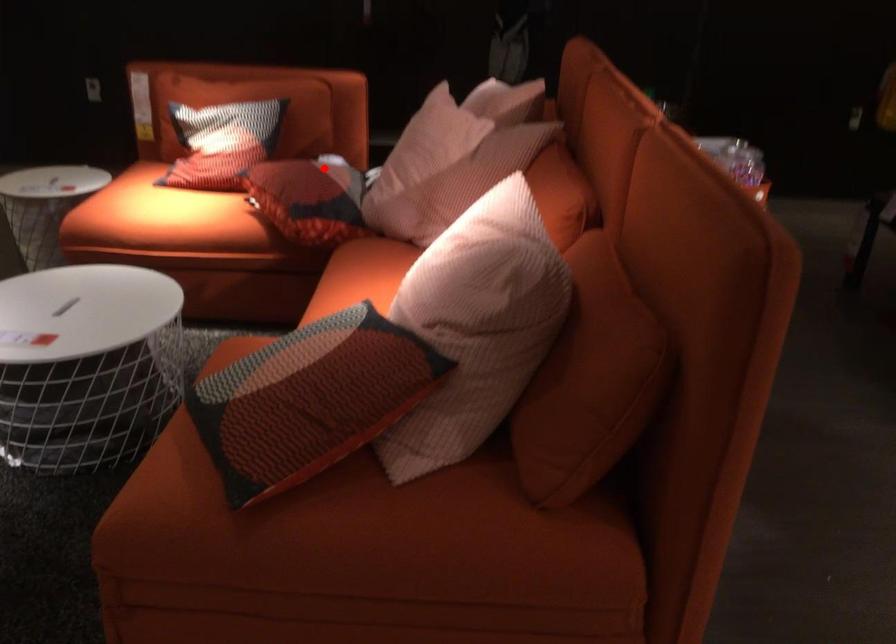
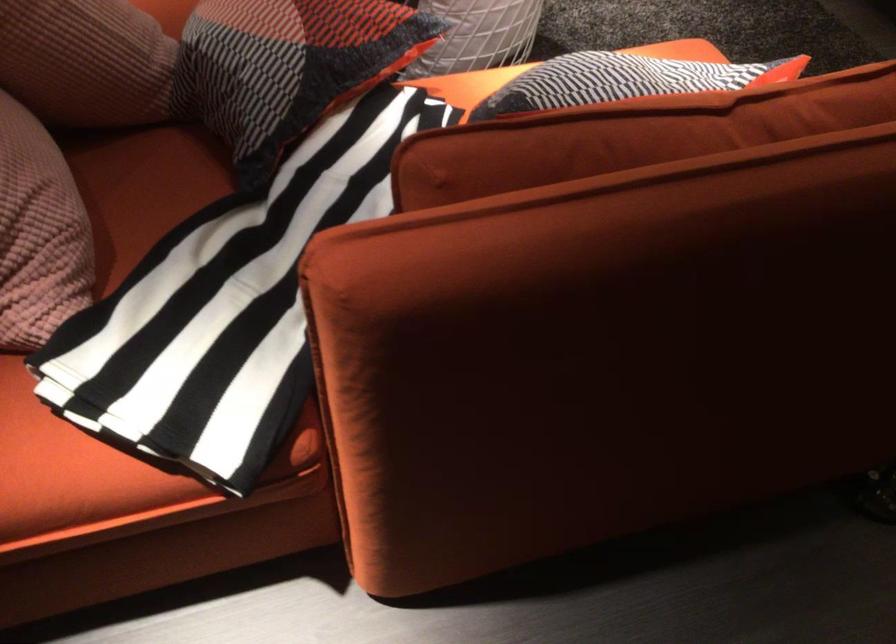
Where in the second image is the point corresponding to the highlighted location from the first image?

(288, 67)